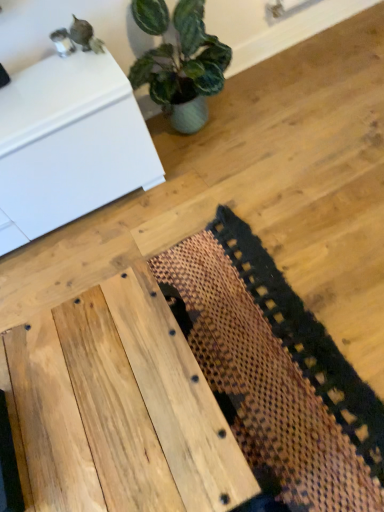
Question: Is the position of natural wood table at center more distant than that of brown woven mat at center?

Choices:
 (A) yes
 (B) no

Answer: (B)

Question: From a real-world perspective, is natural wood table at center positioned under brown woven mat at center based on gravity?

Choices:
 (A) yes
 (B) no

Answer: (B)

Question: Is natural wood table at center at the right side of brown woven mat at center?

Choices:
 (A) no
 (B) yes

Answer: (A)

Question: Can you confirm if natural wood table at center is positioned to the left of brown woven mat at center?

Choices:
 (A) no
 (B) yes

Answer: (B)

Question: Is natural wood table at center touching brown woven mat at center?

Choices:
 (A) no
 (B) yes

Answer: (A)

Question: Considering the relative sizes of natural wood table at center and brown woven mat at center in the image provided, is natural wood table at center smaller than brown woven mat at center?

Choices:
 (A) yes
 (B) no

Answer: (B)

Question: Considering the relative sizes of brown woven mat at center and natural wood table at center in the image provided, is brown woven mat at center smaller than natural wood table at center?

Choices:
 (A) yes
 (B) no

Answer: (A)

Question: Is brown woven mat at center looking in the opposite direction of natural wood table at center?

Choices:
 (A) no
 (B) yes

Answer: (B)

Question: Could you tell me if brown woven mat at center is turned towards natural wood table at center?

Choices:
 (A) no
 (B) yes

Answer: (B)

Question: Can you confirm if brown woven mat at center is taller than natural wood table at center?

Choices:
 (A) yes
 (B) no

Answer: (B)

Question: Is brown woven mat at center touching natural wood table at center?

Choices:
 (A) no
 (B) yes

Answer: (A)

Question: Can natural wood table at center be found inside brown woven mat at center?

Choices:
 (A) yes
 (B) no

Answer: (B)

Question: Is white glossy cabinet at upper left positioned before brown woven mat at center?

Choices:
 (A) no
 (B) yes

Answer: (A)